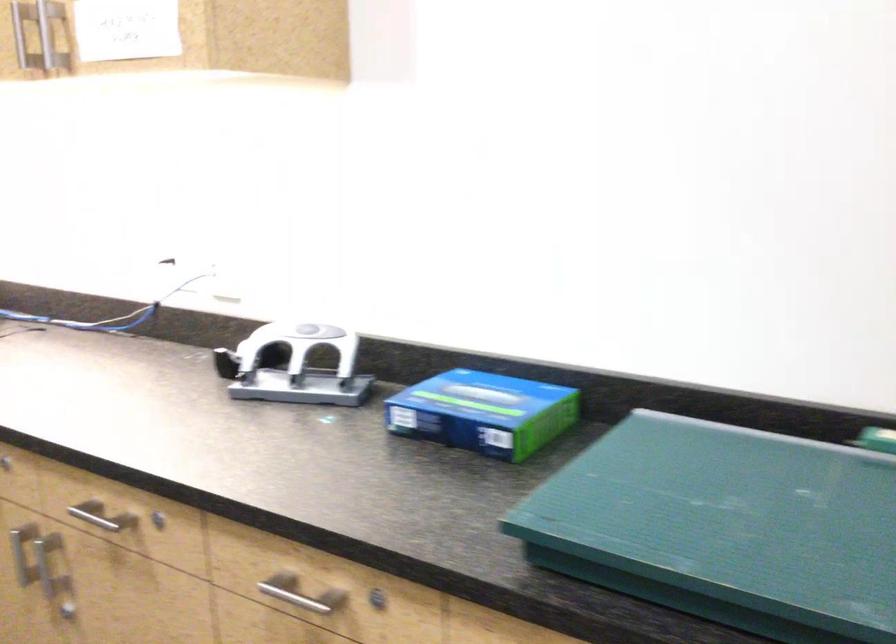
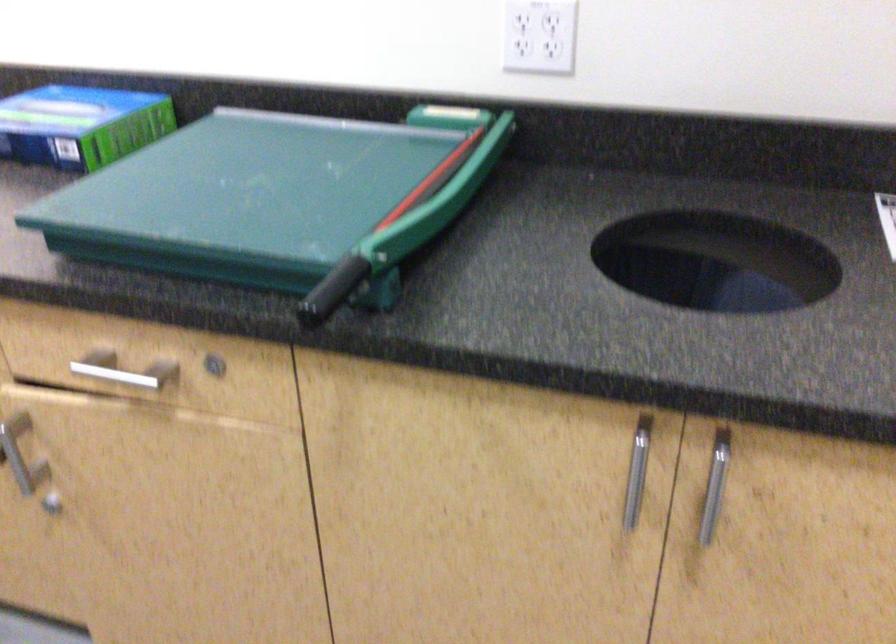
Question: I am providing you with two images of the same scene from different viewpoints. Which of the following objects are not visible in image2?

Choices:
 (A) blue paper box
 (B) vertical silver handle
 (C) wide silver handle
 (D) none of these

Answer: (D)